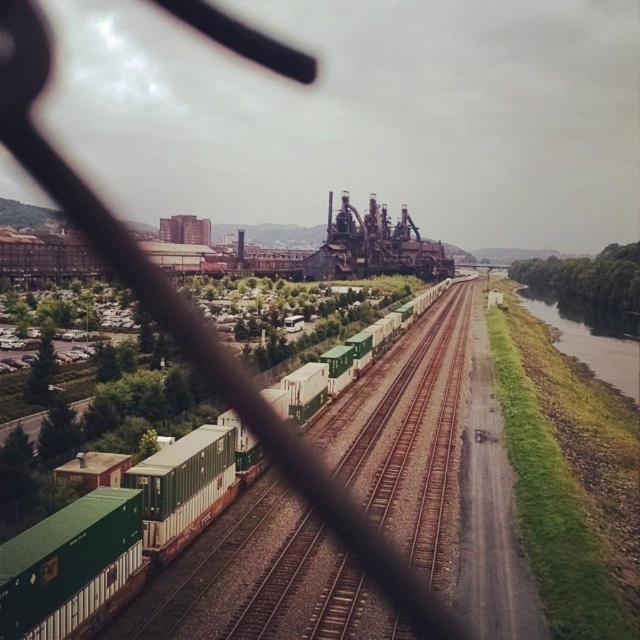
You are a photographer standing at the edge of the riverbank in the industrial area. You want to take a photo that includes both the train and the blast furnace structure. However, you notice two points marked in the scene. One is at point coordinates point (524,304) and the other at point (228,484). Which point should you stand closer to in order to ensure both the train and the blast furnace are in frame?

You should stand closer to point (228,484) because it is closer to the camera than point (524,304). This position will help keep both the train in the foreground and the blast furnace in the background within the frame.

You are standing at the camera position and want to reach the point marked at coordinates (563,307). If your walking speed is 3 feet per second, how many seconds will it take you to reach that point?

The point marked at coordinates (563,307) is 717.51 feet away from the camera. At a walking speed of 3 feet per second, it would take approximately 239 seconds to reach the point.

You are a photographer positioned at the center of the scene. You want to capture a photo that includes both the green matte container at left and the green grassy river at right. Which object should you adjust your camera angle to focus on first to ensure both are in frame?

The green matte container at left is behind the green grassy river at right, so you should adjust your camera angle to focus on the green grassy river at right first to ensure both are visible in the frame.